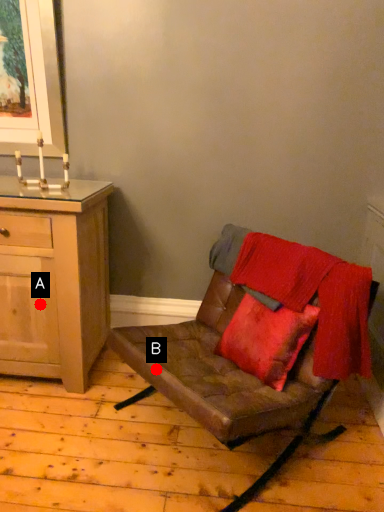
Question: Two points are circled on the image, labeled by A and B beside each circle. Which point is further to the camera?

Choices:
 (A) A is further
 (B) B is further

Answer: (A)